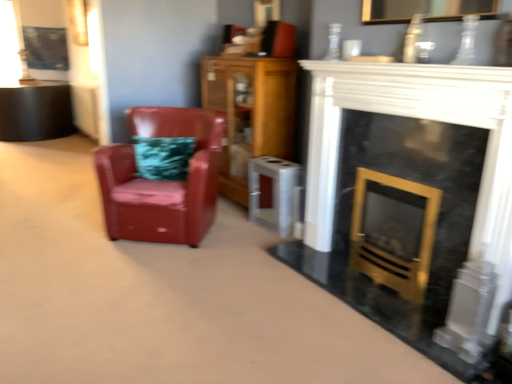
Locate an element on the screen. metallic silver picture frame at upper left is located at coordinates (46, 48).

Describe the element at coordinates (250, 113) in the screenshot. I see `wooden cabinet at center` at that location.

Describe the element at coordinates (162, 180) in the screenshot. This screenshot has width=512, height=384. I see `glossy leather armchair at left` at that location.

You are a GUI agent. You are given a task and a screenshot of the screen. Output one action in this format:
    pyautogui.click(x=<x>, y=<y>)
    Task: Click on the black marble fireplace at center
    This screenshot has height=384, width=512.
    Given the screenshot: What is the action you would take?
    pyautogui.click(x=412, y=201)

Where is `metallic silver picture frame at upper left`? The height and width of the screenshot is (384, 512). metallic silver picture frame at upper left is located at coordinates pos(46,48).

Which object is positioned more to the right, metallic silver picture frame at upper left or glossy leather armchair at left?

glossy leather armchair at left is more to the right.

Is metallic silver picture frame at upper left directly adjacent to glossy leather armchair at left?

They are not placed beside each other.

From the picture: Can you confirm if metallic silver picture frame at upper left is wider than glossy leather armchair at left?

Incorrect, the width of metallic silver picture frame at upper left does not surpass that of glossy leather armchair at left.

Considering the positions of objects metallic silver picture frame at upper left and glossy leather armchair at left in the image provided, who is in front, metallic silver picture frame at upper left or glossy leather armchair at left?

Positioned in front is glossy leather armchair at left.

From the image's perspective, is wooden cabinet at center on top of glossy leather armchair at left?

Yes, from the image's perspective, wooden cabinet at center is above glossy leather armchair at left.

Is wooden cabinet at center wider than glossy leather armchair at left?

In fact, wooden cabinet at center might be narrower than glossy leather armchair at left.

Looking at this image, how much distance is there between wooden cabinet at center and glossy leather armchair at left?

They are 18.39 inches apart.

Locate an element on the screen. This screenshot has height=384, width=512. chair that appears below the wooden cabinet at center (from the image's perspective) is located at coordinates (162, 180).

From a real-world perspective, which is physically above, metallic silver picture frame at upper left or black marble fireplace at center?

metallic silver picture frame at upper left is physically above.

Is metallic silver picture frame at upper left next to black marble fireplace at center?

No.

Which of these two, metallic silver picture frame at upper left or black marble fireplace at center, is bigger?

With larger size is black marble fireplace at center.

Based on the photo, from the image's perspective, which is above, metallic silver picture frame at upper left or black marble fireplace at center?

Answer: metallic silver picture frame at upper left, from the image's perspective.

The width and height of the screenshot is (512, 384). What are the coordinates of `picture frame located behind the glossy leather armchair at left` in the screenshot? It's located at (46, 48).

How distant is glossy leather armchair at left from metallic silver picture frame at upper left?

glossy leather armchair at left and metallic silver picture frame at upper left are 4.09 meters apart from each other.

Between glossy leather armchair at left and metallic silver picture frame at upper left, which one has smaller width?

Thinner between the two is metallic silver picture frame at upper left.

Is glossy leather armchair at left at the right side of metallic silver picture frame at upper left?

Yes.

Considering the sizes of objects wooden cabinet at center and metallic silver picture frame at upper left in the image provided, who is wider, wooden cabinet at center or metallic silver picture frame at upper left?

metallic silver picture frame at upper left.

Between point (220, 65) and point (48, 42), which one is positioned in front?

The point (220, 65) is in front.

Would you say wooden cabinet at center is to the left or to the right of metallic silver picture frame at upper left in the picture?

Clearly, wooden cabinet at center is on the right of metallic silver picture frame at upper left in the image.

Between wooden cabinet at center and black marble fireplace at center, which one has larger size?

wooden cabinet at center is bigger.

Which is closer to the camera, (271, 141) or (372, 249)?

Point (271, 141) is farther from the camera than point (372, 249).

Considering the relative positions of wooden cabinet at center and black marble fireplace at center in the image provided, is wooden cabinet at center to the left or to the right of black marble fireplace at center?

Based on their positions, wooden cabinet at center is located to the left of black marble fireplace at center.

The image size is (512, 384). I want to click on cabinetry behind the black marble fireplace at center, so click(x=250, y=113).

From the image's perspective, which is above, glossy leather armchair at left or wooden cabinet at center?

wooden cabinet at center, from the image's perspective.

Is glossy leather armchair at left completely or partially outside of wooden cabinet at center?

Yes, glossy leather armchair at left is outside of wooden cabinet at center.

How many degrees apart are the facing directions of glossy leather armchair at left and wooden cabinet at center?

The facing directions of glossy leather armchair at left and wooden cabinet at center are 49.1 degrees apart.

The image size is (512, 384). In order to click on picture frame on the left of the glossy leather armchair at left in this screenshot , I will do `click(46, 48)`.

Identify the location of chair below the wooden cabinet at center (from the image's perspective). pyautogui.click(x=162, y=180).

Based on their spatial positions, is glossy leather armchair at left or black marble fireplace at center closer to metallic silver picture frame at upper left?

Based on the image, glossy leather armchair at left appears to be nearer to metallic silver picture frame at upper left.

Which object lies nearer to the anchor point metallic silver picture frame at upper left, black marble fireplace at center or wooden cabinet at center?

wooden cabinet at center is positioned closer to the anchor metallic silver picture frame at upper left.

Looking at the image, which one is located closer to wooden cabinet at center, glossy leather armchair at left or metallic silver picture frame at upper left?

glossy leather armchair at left.

Based on the photo, from the image, which object appears to be nearer to metallic silver picture frame at upper left, wooden cabinet at center or glossy leather armchair at left?

The object closer to metallic silver picture frame at upper left is wooden cabinet at center.

Based on their spatial positions, is glossy leather armchair at left or metallic silver picture frame at upper left closer to black marble fireplace at center?

glossy leather armchair at left is positioned closer to the anchor black marble fireplace at center.

Considering their positions, is glossy leather armchair at left positioned closer to wooden cabinet at center than black marble fireplace at center?

Among the two, glossy leather armchair at left is located nearer to wooden cabinet at center.

Estimate the real-world distances between objects in this image. Which object is closer to wooden cabinet at center, black marble fireplace at center or metallic silver picture frame at upper left?

The object closer to wooden cabinet at center is black marble fireplace at center.

Based on their spatial positions, is metallic silver picture frame at upper left or glossy leather armchair at left closer to wooden cabinet at center?

glossy leather armchair at left is positioned closer to the anchor wooden cabinet at center.

Identify the location of cabinetry between glossy leather armchair at left and metallic silver picture frame at upper left along the z-axis. (250, 113).

Where is `cabinetry positioned between black marble fireplace at center and metallic silver picture frame at upper left from near to far`? cabinetry positioned between black marble fireplace at center and metallic silver picture frame at upper left from near to far is located at coordinates (250, 113).

You are a GUI agent. You are given a task and a screenshot of the screen. Output one action in this format:
    pyautogui.click(x=<x>, y=<y>)
    Task: Click on the chair between black marble fireplace at center and wooden cabinet at center along the z-axis
    Image resolution: width=512 pixels, height=384 pixels.
    Given the screenshot: What is the action you would take?
    pos(162,180)

You are a GUI agent. You are given a task and a screenshot of the screen. Output one action in this format:
    pyautogui.click(x=<x>, y=<y>)
    Task: Click on the chair located between black marble fireplace at center and metallic silver picture frame at upper left in the depth direction
    
    Given the screenshot: What is the action you would take?
    pyautogui.click(x=162, y=180)